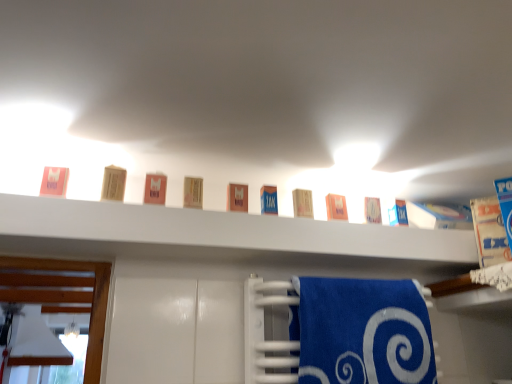
Question: Considering the positions of blue terry cloth towel at lower center and white matte shelf at upper center in the image, is blue terry cloth towel at lower center bigger or smaller than white matte shelf at upper center?

Choices:
 (A) small
 (B) big

Answer: (A)

Question: Is blue terry cloth towel at lower center wider or thinner than white matte shelf at upper center?

Choices:
 (A) thin
 (B) wide

Answer: (A)

Question: In terms of height, does blue terry cloth towel at lower center look taller or shorter compared to white matte shelf at upper center?

Choices:
 (A) short
 (B) tall

Answer: (B)

Question: Considering the relative positions of white matte shelf at upper center and blue terry cloth towel at lower center in the image provided, is white matte shelf at upper center to the left or to the right of blue terry cloth towel at lower center?

Choices:
 (A) right
 (B) left

Answer: (B)

Question: Considering their positions, is white matte shelf at upper center located in front of or behind blue terry cloth towel at lower center?

Choices:
 (A) behind
 (B) front

Answer: (B)

Question: Considering the positions of point click(442, 261) and point click(283, 347), is point click(442, 261) closer or farther from the camera than point click(283, 347)?

Choices:
 (A) farther
 (B) closer

Answer: (A)

Question: Considering the positions of white matte shelf at upper center and blue terry cloth towel at lower center in the image, is white matte shelf at upper center bigger or smaller than blue terry cloth towel at lower center?

Choices:
 (A) big
 (B) small

Answer: (A)